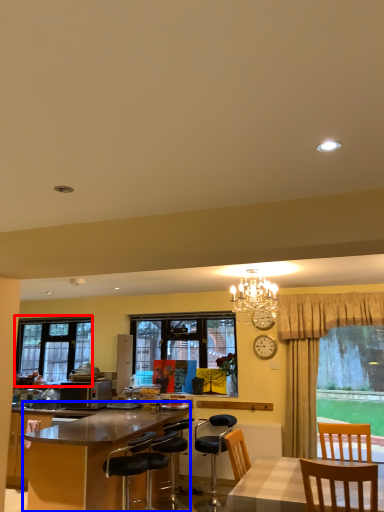
Question: Which point is closer to the camera, window (highlighted by a red box) or desk (highlighted by a blue box)?

Choices:
 (A) window
 (B) desk

Answer: (B)